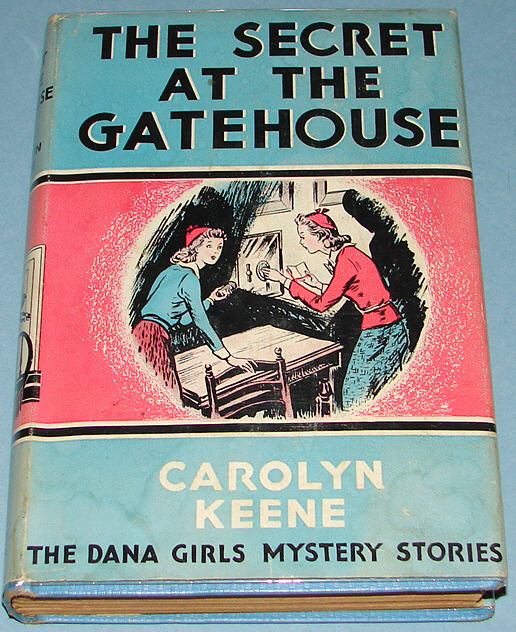
Locate an element on the screen. This screenshot has width=516, height=632. wood table is located at coordinates (283, 334).